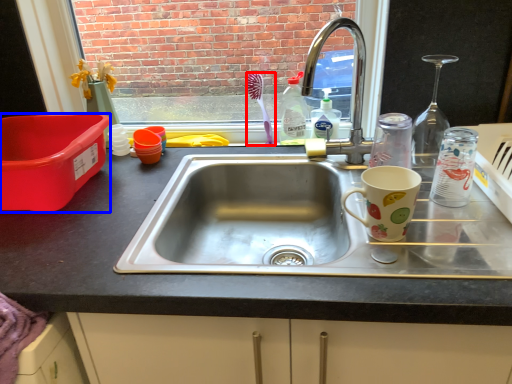
Question: Which of the following is the farthest to the observer, toothbrush (highlighted by a red box) or box (highlighted by a blue box)?

Choices:
 (A) toothbrush
 (B) box

Answer: (A)